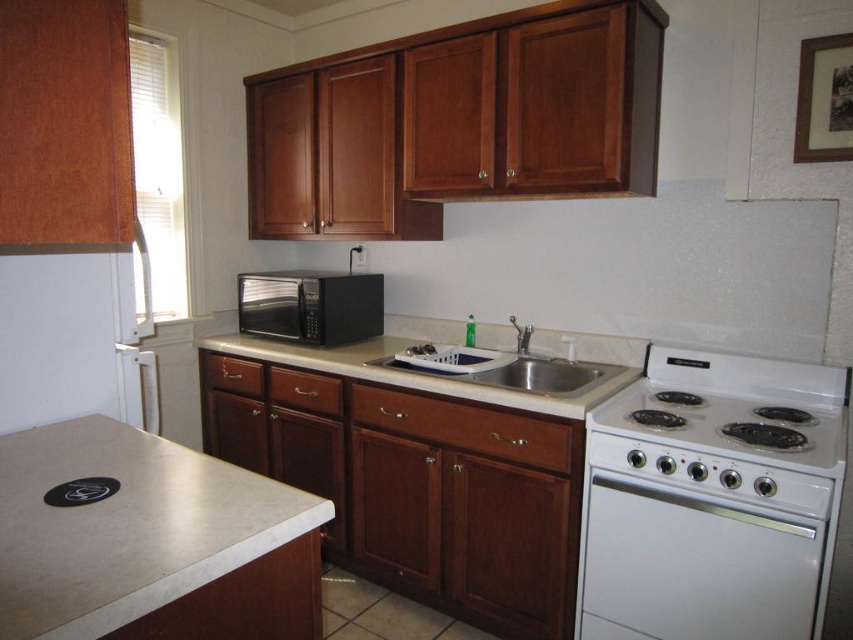
You are a chef preparing to move a hot pot from the white glossy electric stove at right to the stainless steel sink at center. Considering their positions, which appliance should you reach first to avoid spilling the hot contents?

You should reach the white glossy electric stove at right first because it is closer to you than the stainless steel sink at center, so you can quickly move the pot to the sink without spilling.

You are a chef preparing a meal in the kitchen and need to move a cutting board from the beige laminate counter top at lower left to the white glossy electric stove at right. Which direction should you move the cutting board?

The white glossy electric stove at right is positioned on the right side of the beige laminate counter top at lower left, so you should move the cutting board to the right.

You are a chef trying to reach the white glossy electric stove at right to cook dinner. You are currently standing in front of the beige laminate counter top at lower left. Can you easily access the stove from your current position?

The beige laminate counter top at lower left is behind the white glossy electric stove at right, so you are positioned behind the stove. This means you can easily access the stove by stepping around or moving forward from your current position.